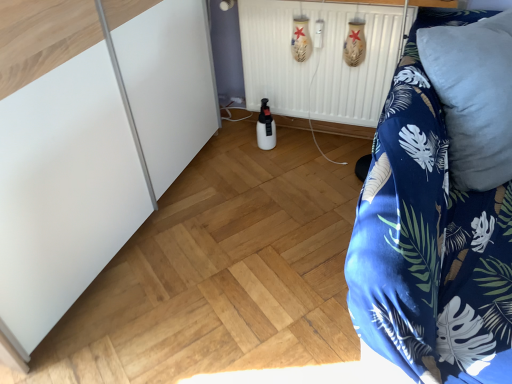
Question: Does blue soft pillow at right appear on the left side of white matte bottle at center?

Choices:
 (A) no
 (B) yes

Answer: (A)

Question: Is blue soft pillow at right beside white matte bottle at center?

Choices:
 (A) no
 (B) yes

Answer: (A)

Question: Can you confirm if blue soft pillow at right is bigger than white matte bottle at center?

Choices:
 (A) no
 (B) yes

Answer: (B)

Question: Could white matte bottle at center be considered to be inside blue soft pillow at right?

Choices:
 (A) yes
 (B) no

Answer: (B)

Question: Is blue soft pillow at right oriented towards white matte bottle at center?

Choices:
 (A) yes
 (B) no

Answer: (B)

Question: From a real-world perspective, is blue soft pillow at right below white matte bottle at center?

Choices:
 (A) yes
 (B) no

Answer: (B)

Question: Is blue soft pillow at right at the back of white matte radiator at center?

Choices:
 (A) yes
 (B) no

Answer: (B)

Question: Is white matte radiator at center with blue soft pillow at right?

Choices:
 (A) yes
 (B) no

Answer: (B)

Question: Is white matte radiator at center thinner than blue soft pillow at right?

Choices:
 (A) no
 (B) yes

Answer: (B)

Question: Is white matte radiator at center to the right of blue soft pillow at right from the viewer's perspective?

Choices:
 (A) no
 (B) yes

Answer: (A)

Question: Is white matte radiator at center facing towards blue soft pillow at right?

Choices:
 (A) no
 (B) yes

Answer: (A)

Question: From a real-world perspective, is white matte radiator at center beneath blue soft pillow at right?

Choices:
 (A) yes
 (B) no

Answer: (A)

Question: Is blue floral fabric at right completely or partially outside of white matte radiator at center?

Choices:
 (A) no
 (B) yes

Answer: (B)